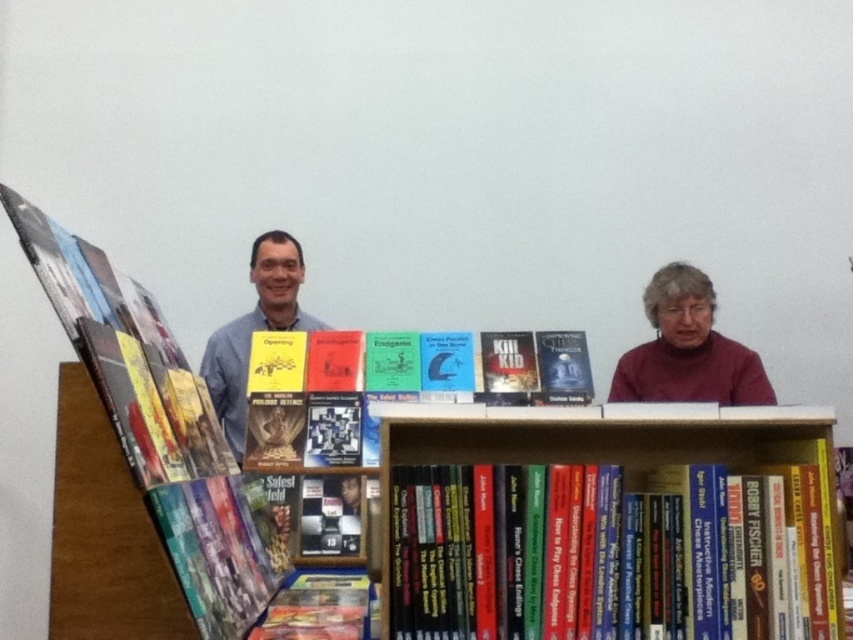
Between hardcover book at center and blue shirt at center, which one appears on the left side from the viewer's perspective?

From the viewer's perspective, blue shirt at center appears more on the left side.

Can you confirm if hardcover book at center is positioned to the left of blue shirt at center?

No, hardcover book at center is not to the left of blue shirt at center.

This screenshot has height=640, width=853. What do you see at coordinates (315, 401) in the screenshot?
I see `hardcover book at center` at bounding box center [315, 401].

Where is `hardcover book at center`? The image size is (853, 640). hardcover book at center is located at coordinates (315, 401).

Between maroon sweater at upper right and blue shirt at center, which one appears on the right side from the viewer's perspective?

Positioned to the right is maroon sweater at upper right.

Who is shorter, maroon sweater at upper right or blue shirt at center?

maroon sweater at upper right is shorter.

Which is behind, point (694, 336) or point (219, 364)?

The point (694, 336) is behind.

Image resolution: width=853 pixels, height=640 pixels. Identify the location of maroon sweater at upper right. (688, 349).

Does point (607, 467) lie in front of point (706, 291)?

That is True.

Can you confirm if black hardcover book at center is smaller than maroon sweater at upper right?

Yes.

Between point (444, 483) and point (659, 388), which one is positioned behind?

Point (659, 388)

At what (x,y) coordinates should I click in order to perform the action: click on black hardcover book at center. Please return your answer as a coordinate pair (x, y). Looking at the image, I should click on (592, 556).